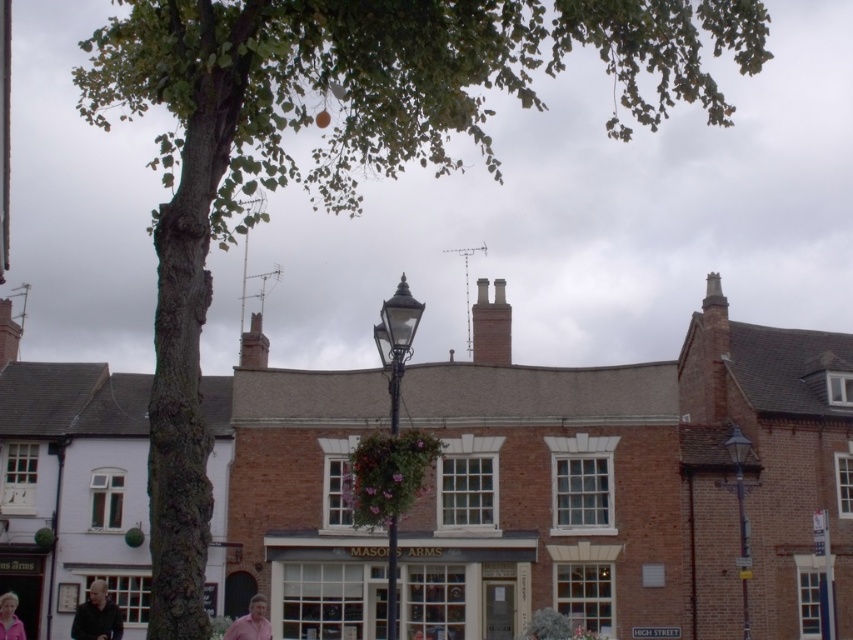
Question: Which object is closer to the camera taking this photo?

Choices:
 (A) polished brass lamp post at center
 (B) pink fabric at lower left

Answer: (A)

Question: Is white wooden signboard at center below polished brass lamp post at center?

Choices:
 (A) no
 (B) yes

Answer: (B)

Question: Is polished brass lamp post at center above pink fabric shirt at lower center?

Choices:
 (A) yes
 (B) no

Answer: (A)

Question: Based on their relative distances, which object is farther from the dark brown leather jacket at lower left?

Choices:
 (A) pink fabric shirt at lower center
 (B) matte black lamp post at right
 (C) pink fabric at lower left
 (D) polished brass lamp post at center

Answer: (B)

Question: Which is farther from the polished brass lamp post at center?

Choices:
 (A) pink fabric shirt at lower center
 (B) pink fabric at lower left

Answer: (B)

Question: Is polished brass lamp post at center above matte black lamp post at right?

Choices:
 (A) yes
 (B) no

Answer: (A)